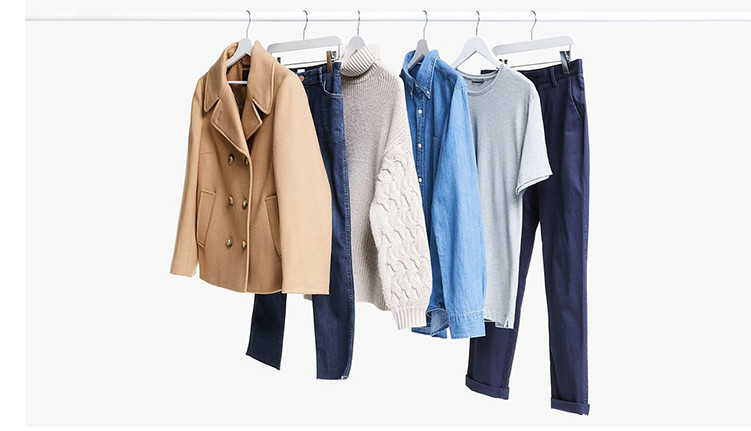
At what (x,y) coordinates should I click in order to perform the action: click on hangers. Please return your answer as a coordinate pair (x, y). Looking at the image, I should click on (242, 46), (312, 46), (348, 43), (418, 53), (474, 55), (520, 54).